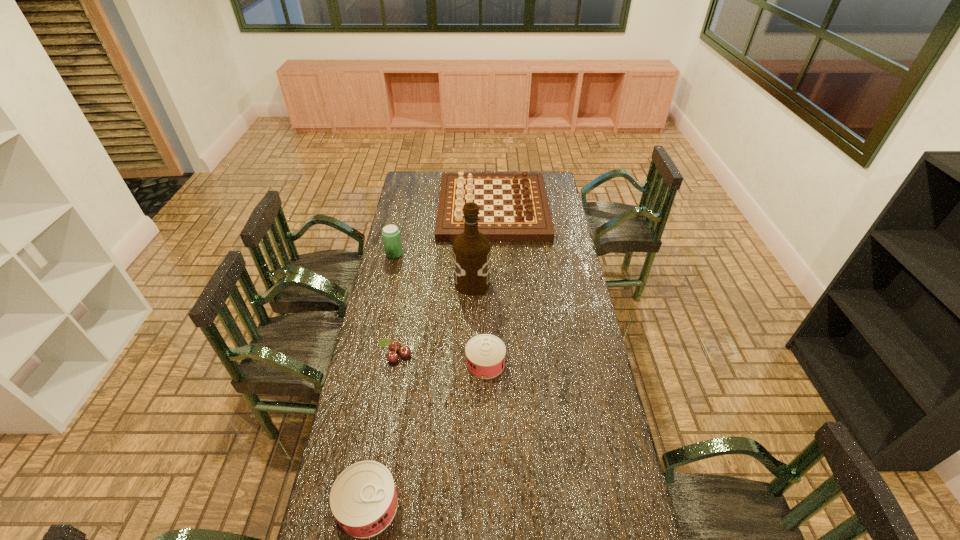
Identify the location of blank region between the second farthest object and the taller can. This screenshot has width=960, height=540. (381, 380).

Find the location of `vacant region between the soda and the tallest object`. vacant region between the soda and the tallest object is located at coordinates (433, 269).

You are a GUI agent. You are given a task and a screenshot of the screen. Output one action in this format:
    pyautogui.click(x=<x>, y=<y>)
    Task: Click on the vacant region between the cherry and the fifth nearest object
    
    Given the screenshot: What is the action you would take?
    pyautogui.click(x=396, y=305)

You are a GUI agent. You are given a task and a screenshot of the screen. Output one action in this format:
    pyautogui.click(x=<x>, y=<y>)
    Task: Click on the vacant space in between the third farthest object and the nearest object
    Image resolution: width=960 pixels, height=540 pixels.
    Given the screenshot: What is the action you would take?
    pyautogui.click(x=420, y=394)

At what (x,y) coordinates should I click in order to perform the action: click on free spot between the alcohol and the cherry. Please return your answer as a coordinate pair (x, y). This screenshot has width=960, height=540. Looking at the image, I should click on (434, 320).

Find the location of a particular element. vacant area that lies between the cherry and the fourth nearest object is located at coordinates (434, 320).

Identify which object is the nearest to the soda. Please provide its 2D coordinates. Your answer should be formatted as a tuple, i.e. [(x, y)], where the tuple contains the x and y coordinates of a point satisfying the conditions above.

[(525, 215)]

Point out which object is positioned as the third nearest to the tallest object. Please provide its 2D coordinates. Your answer should be formatted as a tuple, i.e. [(x, y)], where the tuple contains the x and y coordinates of a point satisfying the conditions above.

[(485, 354)]

This screenshot has width=960, height=540. I want to click on vacant position in the image that satisfies the following two spatial constraints: 1. on the back side of the taller can; 2. on the left side of the shorter can, so click(x=393, y=363).

Locate an element on the screen. vacant point that satisfies the following two spatial constraints: 1. on the label of the alcohol; 2. on the leaves of the cherry is located at coordinates (470, 355).